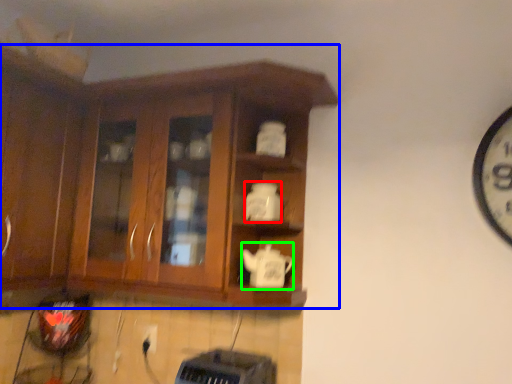
Question: Estimate the real-world distances between objects in this image. Which object is closer to teapot (highlighted by a red box), cabinetry (highlighted by a blue box) or teapot (highlighted by a green box)?

Choices:
 (A) cabinetry
 (B) teapot

Answer: (B)